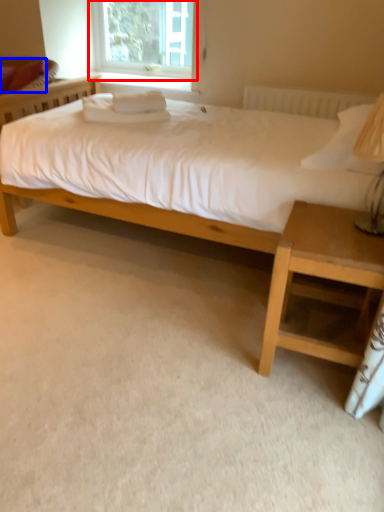
Question: Which object is closer to the camera taking this photo, window (highlighted by a red box) or pillow (highlighted by a blue box)?

Choices:
 (A) window
 (B) pillow

Answer: (B)